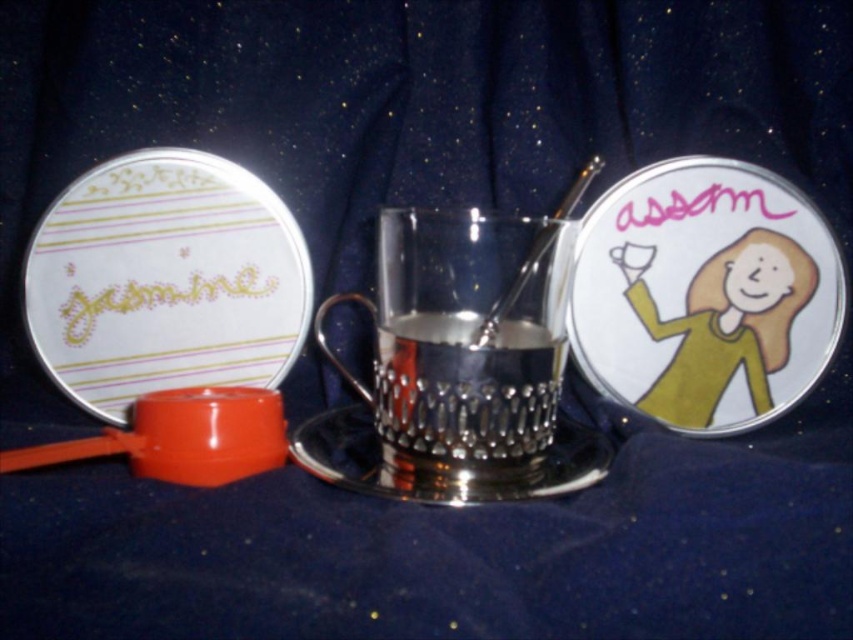
Question: Considering the real-world distances, which object is farthest from the matte white plate at left?

Choices:
 (A) polished silver cup at center
 (B) polished metal spoon at center

Answer: (B)

Question: Is polished silver cup at center closer to the viewer compared to silver textured saucer at center?

Choices:
 (A) no
 (B) yes

Answer: (A)

Question: Observing the image, what is the correct spatial positioning of polished silver cup at center in reference to polished metal spoon at center?

Choices:
 (A) above
 (B) below

Answer: (B)

Question: Which of the following is the farthest from the observer?

Choices:
 (A) (437, 232)
 (B) (755, 230)
 (C) (483, 342)

Answer: (B)

Question: Which point appears closest to the camera in this image?

Choices:
 (A) (648, 200)
 (B) (193, 166)
 (C) (583, 182)
 (D) (485, 429)

Answer: (D)

Question: Is silver textured saucer at center in front of polished metal spoon at center?

Choices:
 (A) no
 (B) yes

Answer: (B)